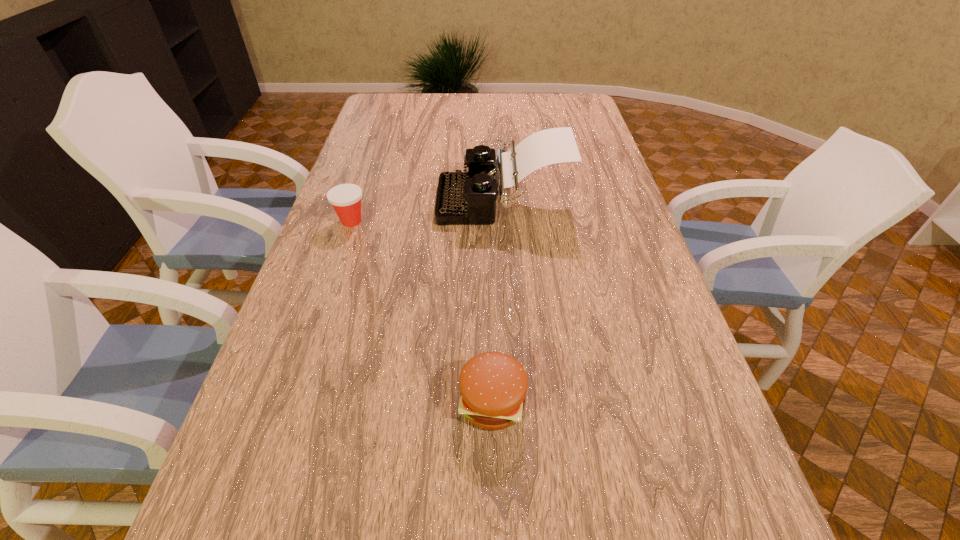
I want to click on typewriter, so click(x=463, y=198).

Where is `Dixie cup`? Image resolution: width=960 pixels, height=540 pixels. Dixie cup is located at coordinates (345, 198).

Where is `the nearest object`? the nearest object is located at coordinates (493, 385).

Find the location of a particular element. Image resolution: width=960 pixels, height=540 pixels. vacant region located on the keys of the typewriter is located at coordinates (419, 200).

At what (x,y) coordinates should I click in order to perform the action: click on free spot located on the keys of the typewriter. Please return your answer as a coordinate pair (x, y). Looking at the image, I should click on (396, 200).

Image resolution: width=960 pixels, height=540 pixels. I want to click on vacant region located on the keys of the typewriter, so click(412, 200).

Find the location of a particular element. The height and width of the screenshot is (540, 960). free location located on the back of the leftmost object is located at coordinates (375, 149).

Find the location of a particular element. The height and width of the screenshot is (540, 960). free space located on the right of the nearest object is located at coordinates (610, 402).

Where is `object situated at the left edge`? object situated at the left edge is located at coordinates (345, 198).

Locate an element on the screen. This screenshot has height=540, width=960. free space at the far edge of the desktop is located at coordinates (410, 107).